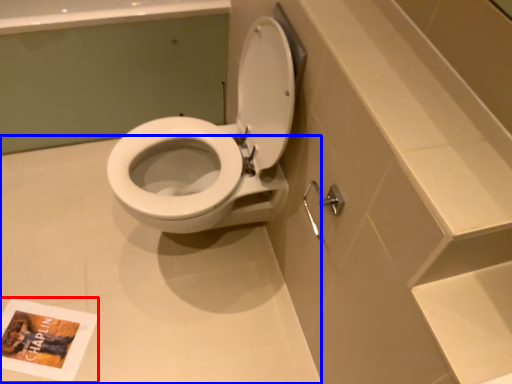
Question: Which object is further to the camera taking this photo, book cover (highlighted by a red box) or plain (highlighted by a blue box)?

Choices:
 (A) book cover
 (B) plain

Answer: (A)